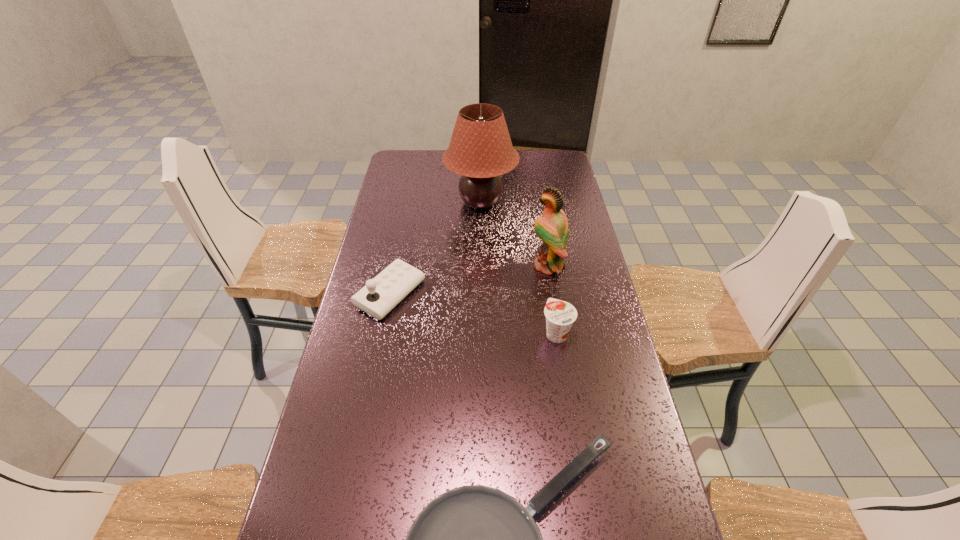
Find the location of a particular element. The width and height of the screenshot is (960, 540). vacant space located on the left of the second shortest object is located at coordinates (449, 333).

Locate an element on the screen. The width and height of the screenshot is (960, 540). object that is at the left edge is located at coordinates (380, 295).

Locate an element on the screen. parrot at the right edge is located at coordinates (552, 228).

Identify the location of yogurt located at the right edge. (560, 315).

What are the coordinates of `free location at the far edge of the desktop` in the screenshot? It's located at (529, 157).

The width and height of the screenshot is (960, 540). What are the coordinates of `blank area at the left edge` in the screenshot? It's located at (376, 217).

I want to click on vacant position at the right edge of the desktop, so click(x=584, y=281).

Find the location of a particular element. This screenshot has width=960, height=540. free location at the far right corner is located at coordinates (540, 158).

This screenshot has width=960, height=540. What are the coordinates of `vacant space that is in between the farthest object and the joystick` in the screenshot? It's located at (436, 248).

The height and width of the screenshot is (540, 960). I want to click on free space that is in between the tallest object and the yogurt, so click(x=518, y=268).